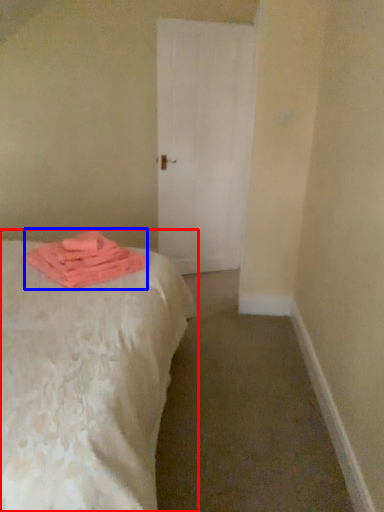
Question: Which object appears closest to the camera in this image, bed (highlighted by a red box) or material (highlighted by a blue box)?

Choices:
 (A) bed
 (B) material

Answer: (A)